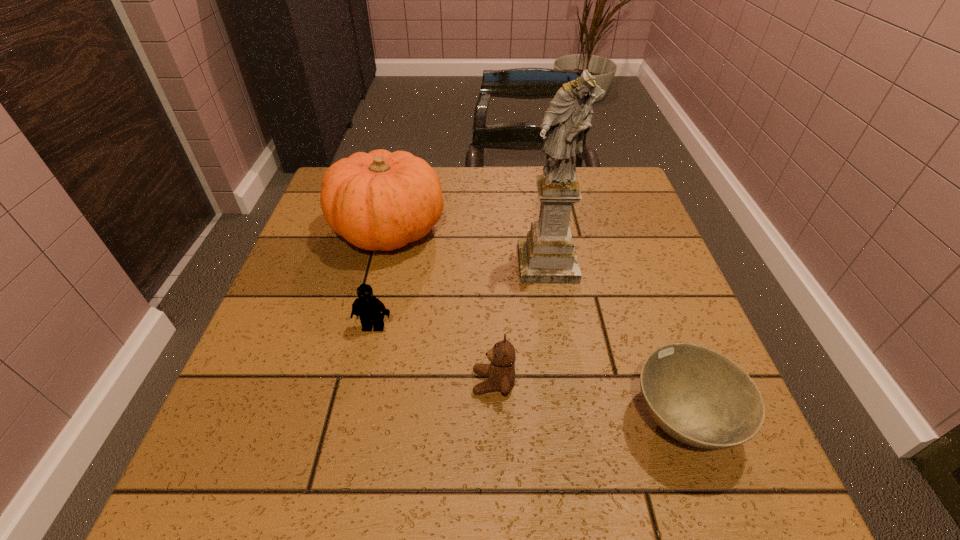
The image size is (960, 540). I want to click on free space between the teddy bear and the third nearest object, so click(434, 355).

Where is `free point between the third nearest object and the bowl`? Image resolution: width=960 pixels, height=540 pixels. free point between the third nearest object and the bowl is located at coordinates (528, 374).

Find the location of `vacant space that's between the rightmost object and the third nearest object`. vacant space that's between the rightmost object and the third nearest object is located at coordinates (528, 374).

In order to click on free space between the tallest object and the shortest object in this screenshot , I will do `click(614, 342)`.

You are a GUI agent. You are given a task and a screenshot of the screen. Output one action in this format:
    pyautogui.click(x=<x>, y=<y>)
    Task: Click on the free space between the shortest object and the Lego
    The image size is (960, 540).
    Given the screenshot: What is the action you would take?
    pyautogui.click(x=528, y=374)

Point out which object is positioned as the second nearest to the teddy bear. Please provide its 2D coordinates. Your answer should be formatted as a tuple, i.e. [(x, y)], where the tuple contains the x and y coordinates of a point satisfying the conditions above.

[(698, 396)]

Select which object appears as the closest to the third nearest object. Please provide its 2D coordinates. Your answer should be formatted as a tuple, i.e. [(x, y)], where the tuple contains the x and y coordinates of a point satisfying the conditions above.

[(381, 200)]

At what (x,y) coordinates should I click in order to perform the action: click on vacant space that satisfies the following two spatial constraints: 1. on the face of the Lego; 2. on the left side of the shortest object. Please return your answer as a coordinate pair (x, y). Image resolution: width=960 pixels, height=540 pixels. Looking at the image, I should click on (352, 421).

Image resolution: width=960 pixels, height=540 pixels. Find the location of `vacant space that satisfies the following two spatial constraints: 1. on the front-facing side of the fourth object from left to right; 2. at the face of the teddy bear`. vacant space that satisfies the following two spatial constraints: 1. on the front-facing side of the fourth object from left to right; 2. at the face of the teddy bear is located at coordinates (566, 382).

Locate an element on the screen. free space that satisfies the following two spatial constraints: 1. on the face of the Lego; 2. on the right side of the bowl is located at coordinates (352, 421).